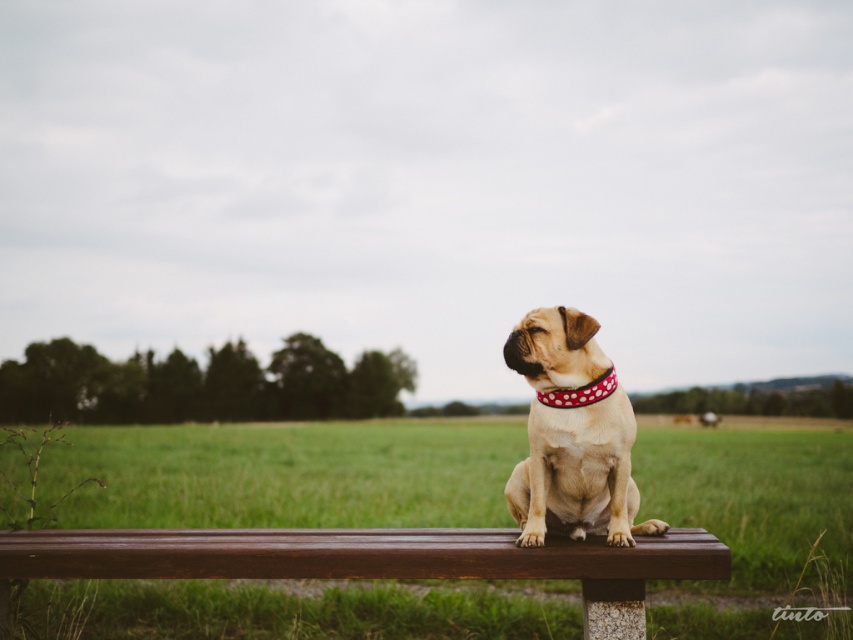
Is brown wooden bench at center smaller than light brown fur at center?

No, brown wooden bench at center is not smaller than light brown fur at center.

I want to click on brown wooden bench at center, so click(x=376, y=560).

The width and height of the screenshot is (853, 640). I want to click on brown wooden bench at center, so click(376, 560).

Which of these two, wooden bench at center or red dotted fabric neckband at center, stands shorter?

red dotted fabric neckband at center is shorter.

Based on the photo, is wooden bench at center further to the viewer compared to red dotted fabric neckband at center?

No.

Does point (347, 595) lie behind point (593, 387)?

Yes, it is.

Find the location of a particular element. This screenshot has height=640, width=853. wooden bench at center is located at coordinates (285, 474).

Is wooden bench at center taller than light brown fur at center?

Yes, wooden bench at center is taller than light brown fur at center.

Is wooden bench at center closer to the viewer compared to light brown fur at center?

Yes, it is in front of light brown fur at center.

Identify the location of wooden bench at center. (285, 474).